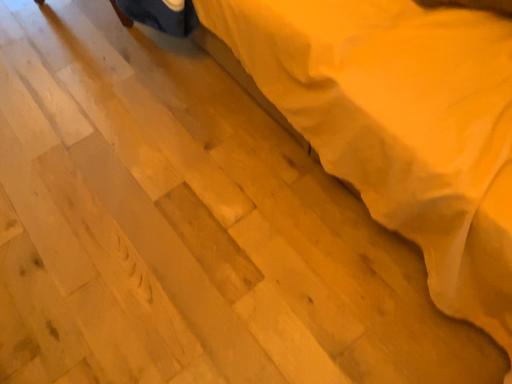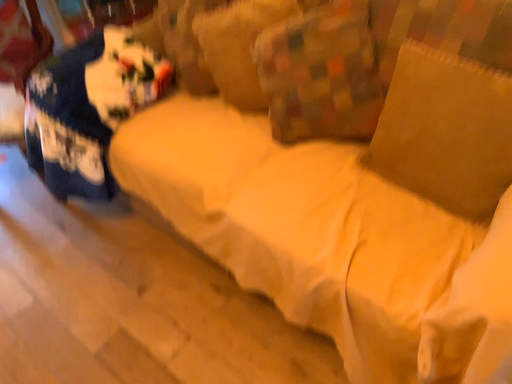
Question: How did the camera likely rotate when shooting the video?

Choices:
 (A) rotated upward
 (B) rotated downward

Answer: (A)